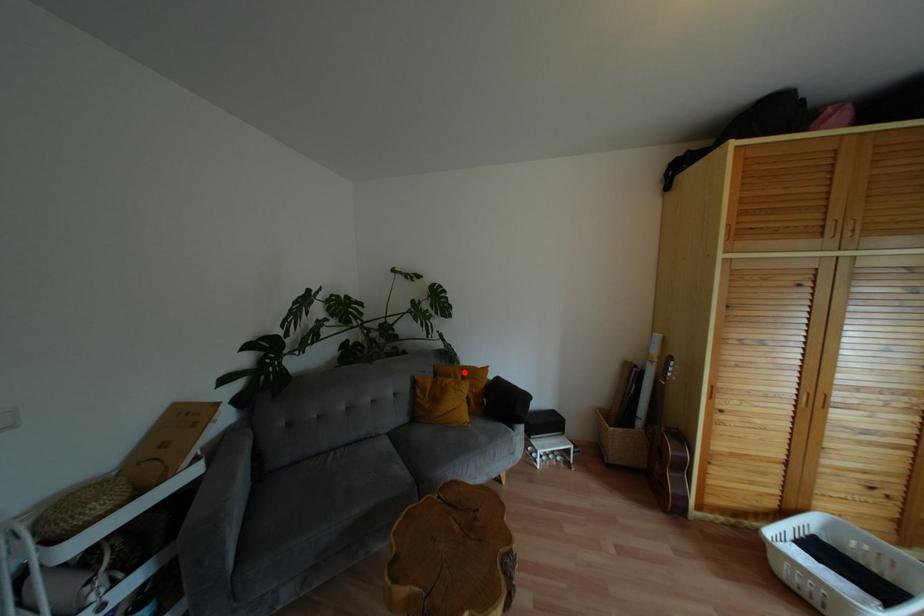
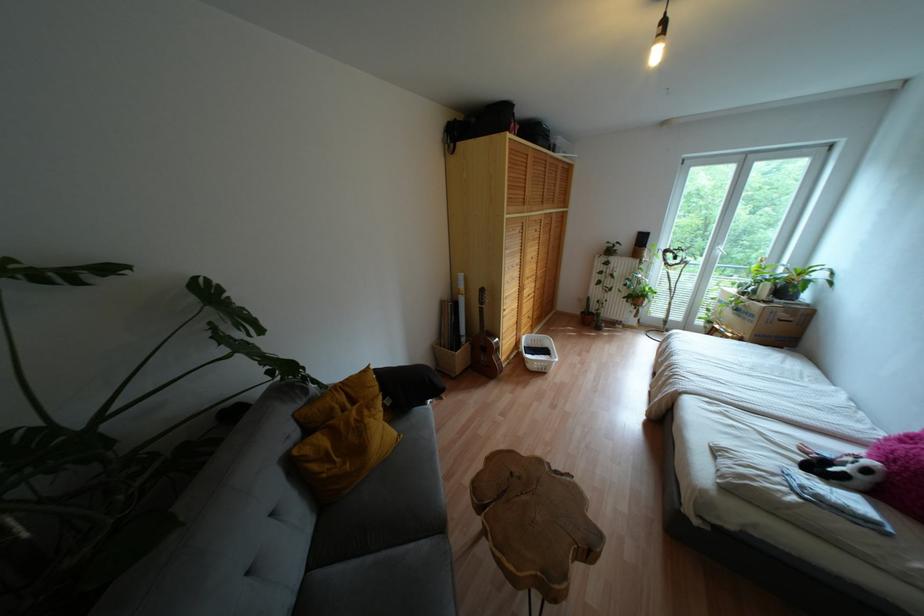
Question: I am providing you with two images of the same scene from different viewpoints. A red point is shown in image1. For the corresponding object point in image2, is it positioned nearer or farther from the camera?

Choices:
 (A) Nearer
 (B) Farther

Answer: (A)